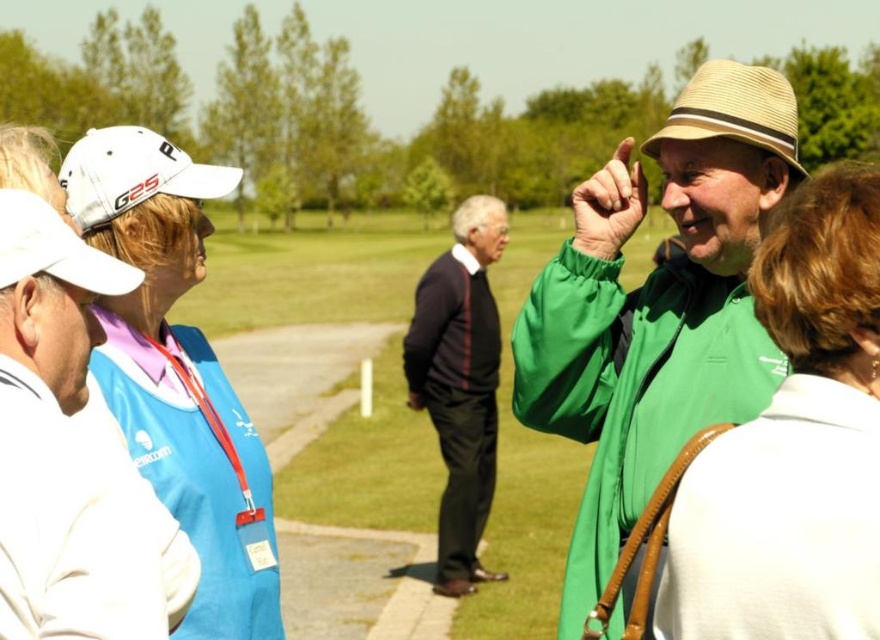
Looking at this image, you are a photographer trying to capture a group photo of the green matte jacket at center and the white matte baseball cap at upper left. Based on their heights, which object should you position closer to the camera to ensure both appear equally tall in the photo?

The green matte jacket at center has a lesser height compared to the white matte baseball cap at upper left. To make them appear equally tall in the photo, position the green matte jacket at center closer to the camera since it is shorter.

You are standing at the point marked as point [697,420] on the golf course. You want to walk to the nearest tree located 14.95 feet away from you. Is the nearest tree within a 15 feet radius from your current position?

The distance of point [697,420] from viewer is 14.95 feet, so the nearest tree is within a 15 feet radius from your current position.

You are a photographer standing at the back of the golf course. You want to take a photo of the white matte baseball cap at upper left and the straw hat at upper right. Which hat should you zoom in on first to ensure both are in focus?

The white matte baseball cap at upper left is closer to the viewer than the straw hat at upper right. To ensure both are in focus, you should zoom in on the white matte baseball cap at upper left first, as it is nearer and adjusting focus starting from closer objects helps capture both in the frame.